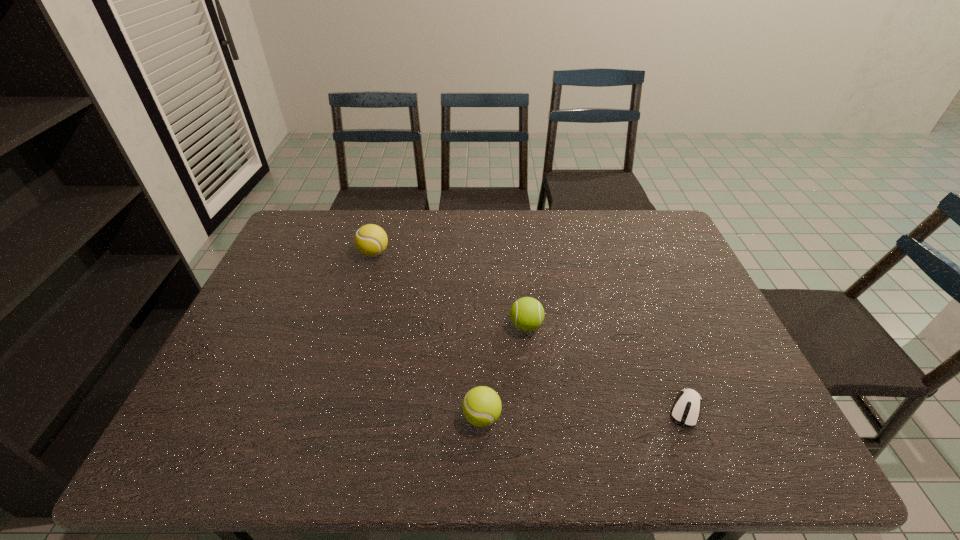
Where is `vacant space that's between the farthest object and the rightmost object`? This screenshot has width=960, height=540. vacant space that's between the farthest object and the rightmost object is located at coordinates (530, 331).

Find the location of `vacant space in between the farthest tennis ball and the shortest object`. vacant space in between the farthest tennis ball and the shortest object is located at coordinates (530, 331).

In order to click on vacant space that is in between the mouse and the third nearest object in this screenshot , I will do `click(606, 367)`.

The height and width of the screenshot is (540, 960). I want to click on object that stands as the third closest to the second object from left to right, so click(x=371, y=240).

Image resolution: width=960 pixels, height=540 pixels. I want to click on the closest object to the rightmost object, so click(527, 314).

Where is `the second closest tennis ball to the farthest object`? the second closest tennis ball to the farthest object is located at coordinates (481, 406).

At what (x,y) coordinates should I click in order to perform the action: click on the closest tennis ball relative to the leftmost object. Please return your answer as a coordinate pair (x, y). Image resolution: width=960 pixels, height=540 pixels. Looking at the image, I should click on 527,314.

This screenshot has height=540, width=960. What are the coordinates of `vacant space that satisfies the following two spatial constraints: 1. on the front side of the second tennis ball from left to right; 2. on the left side of the leftmost object` in the screenshot? It's located at click(327, 417).